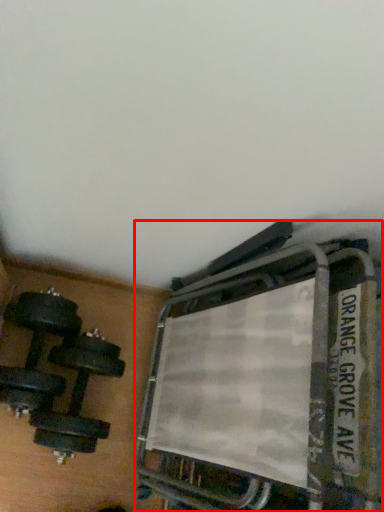
Question: From the image's perspective, where is bunk bed (annotated by the red box) located in relation to dumbbell in the image?

Choices:
 (A) above
 (B) below

Answer: (A)